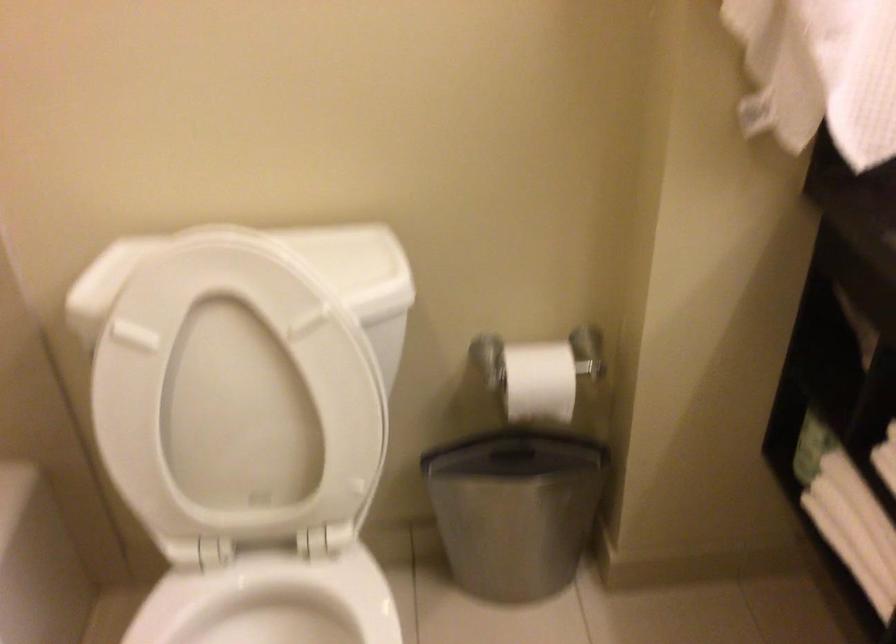
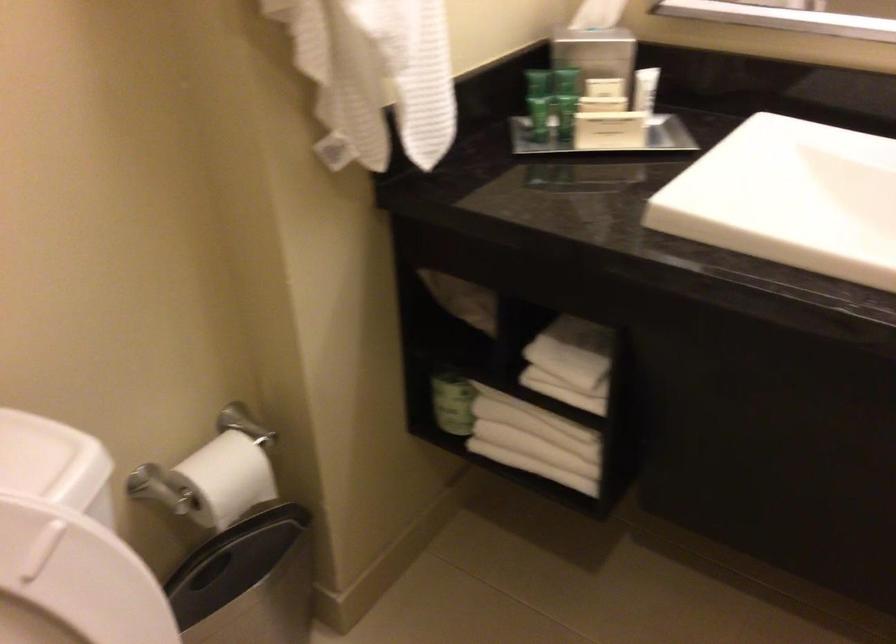
The point at (x=634, y=144) is marked in the first image. Where is the corresponding point in the second image?

(218, 210)